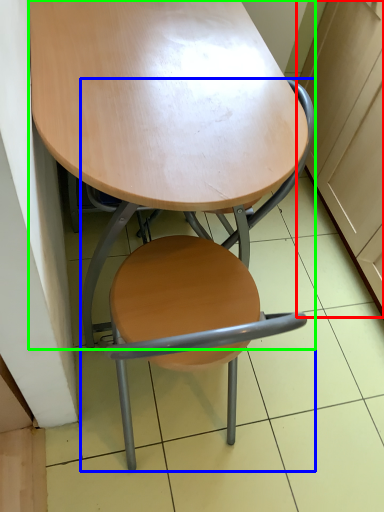
Question: Based on their relative distances, which object is farther from cabinetry (highlighted by a red box)? Choose from chair (highlighted by a blue box) and table (highlighted by a green box).

Choices:
 (A) chair
 (B) table

Answer: (B)